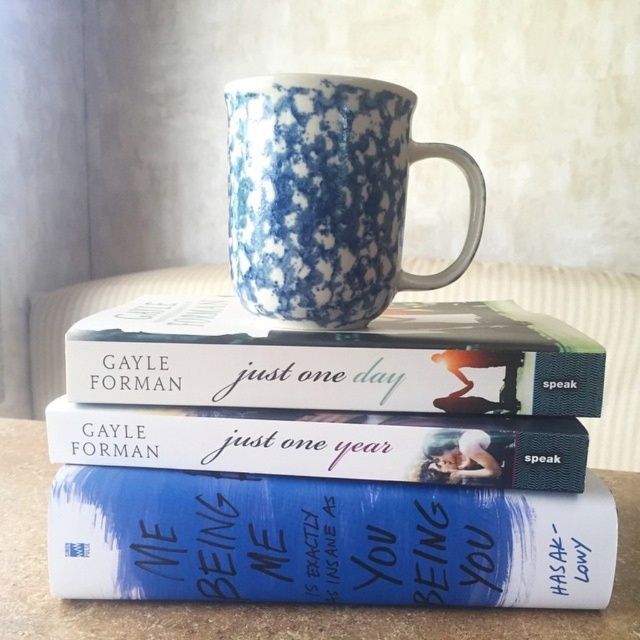
Between matte hardcover book at center and speckled ceramic mug at center, which one appears on the left side from the viewer's perspective?

matte hardcover book at center is more to the left.

Is matte hardcover book at center closer to camera compared to speckled ceramic mug at center?

Yes.

Is point (160, 381) in front of point (298, 92)?

No, (160, 381) is behind (298, 92).

Image resolution: width=640 pixels, height=640 pixels. Identify the location of matte hardcover book at center. (336, 358).

Is point (364, 522) positioned behind point (356, 120)?

No, it is not.

Is white matte book at center positioned at the back of speckled ceramic mug at center?

→ No, it is not.

Locate an element on the screen. Image resolution: width=640 pixels, height=640 pixels. white matte book at center is located at coordinates (324, 540).

Who is positioned more to the right, white matte book at center or matte hardcover book at center?

Positioned to the right is white matte book at center.

Does white matte book at center have a lesser height compared to matte hardcover book at center?

Yes.

Does point (182, 476) come in front of point (300, 404)?

That is True.

At what (x,y) coordinates should I click in order to perform the action: click on white matte book at center. Please return your answer as a coordinate pair (x, y). Looking at the image, I should click on (324, 540).